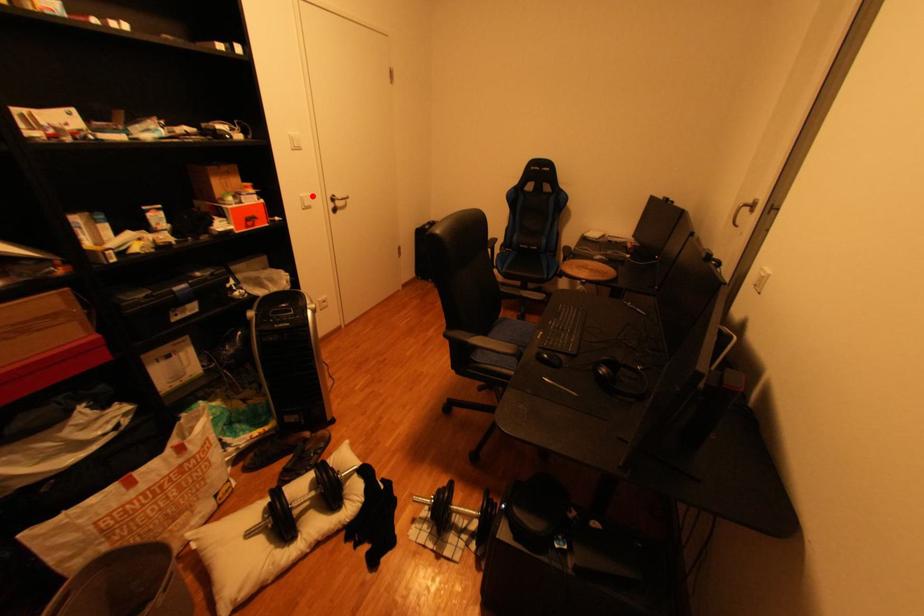
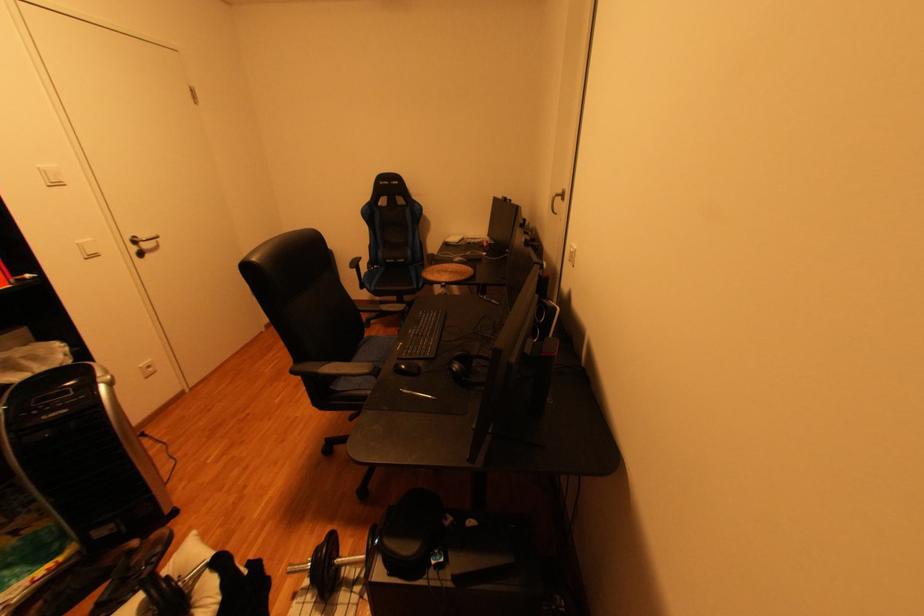
Question: I am providing you with two images of the same scene from different viewpoints. Image1 has a red point marked. In image2, the corresponding 3D location appears at what relative position? Reply with the corresponding letter.

Choices:
 (A) Closer
 (B) Farther

Answer: (B)